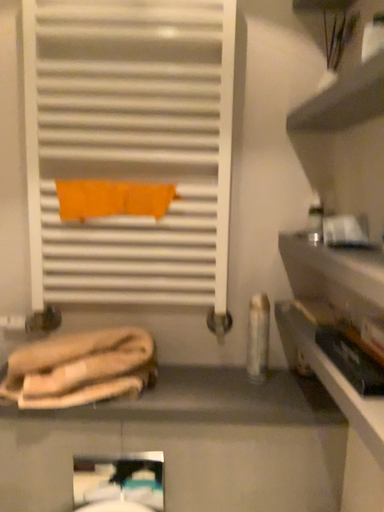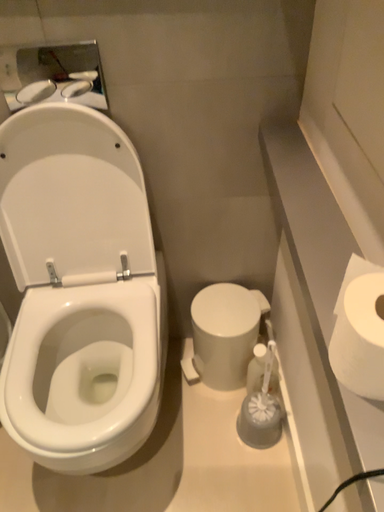
Question: How did the camera likely rotate when shooting the video?

Choices:
 (A) rotated downward
 (B) rotated upward

Answer: (A)